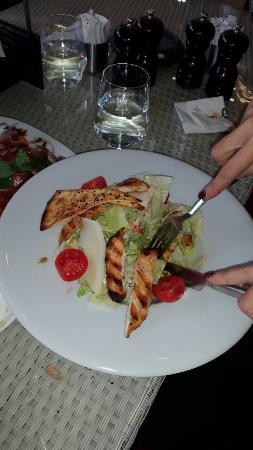
Locate an element on the screen. The height and width of the screenshot is (450, 253). table is located at coordinates (56, 419).